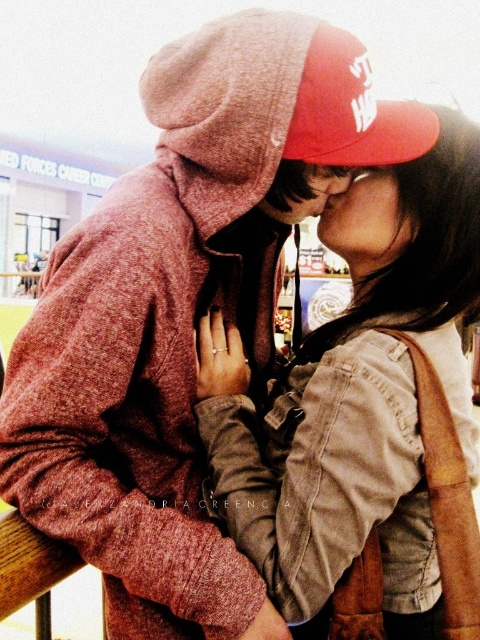
You are a fashion designer analyzing the image. You need to determine which item has a smaller width between the matte brown jacket at center and the red cotton baseball cap at upper center. Which one is it?

The matte brown jacket at center is thinner than the red cotton baseball cap at upper center, so the matte brown jacket at center has a smaller width.

In the scene shown: You are standing in the shopping mall where the couple is kissing. You want to take a photo of the couple from your current position. The scene includes a point at coordinates point (x=445, y=428) and another at point (x=201, y=68). Which point is closer to you?

Point (x=445, y=428) is closer to the viewer than point (x=201, y=68), so you should focus your camera on that point to capture the couple effectively.

You are a photographer who wants to capture a closeup of the matte brown jacket at center and the red cotton baseball cap at upper center in the scene. Which object should you focus on first if you want to ensure both are in focus without moving the camera?

The matte brown jacket at center should be focused on first because it is positioned on the right side of the red cotton baseball cap at upper center, so adjusting focus to the farther object first may help keep both in focus.